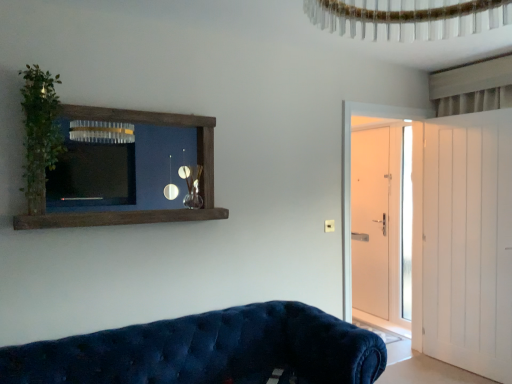
Question: Is green leafy plant at left surrounding white wooden door at right, placed as the second door when sorted from back to front?

Choices:
 (A) no
 (B) yes

Answer: (A)

Question: Is the position of green leafy plant at left more distant than that of white wooden door at right, the 2th door from the front?

Choices:
 (A) yes
 (B) no

Answer: (B)

Question: Is green leafy plant at left taller than white wooden door at right, the 2th door from the front?

Choices:
 (A) no
 (B) yes

Answer: (A)

Question: Are green leafy plant at left and white wooden door at right, the 2th door from the front, located far from each other?

Choices:
 (A) yes
 (B) no

Answer: (A)

Question: Is green leafy plant at left looking in the opposite direction of white wooden door at right, the 2th door from the front?

Choices:
 (A) yes
 (B) no

Answer: (B)

Question: From the image's perspective, is green leafy plant at left located beneath white wooden door at right, placed as the second door when sorted from back to front?

Choices:
 (A) yes
 (B) no

Answer: (B)

Question: Can you confirm if brown wooden shelf at upper left is shorter than white smooth door at right, the third door from the front?

Choices:
 (A) yes
 (B) no

Answer: (A)

Question: From a real-world perspective, is brown wooden shelf at upper left over white smooth door at right, the third door from the front?

Choices:
 (A) no
 (B) yes

Answer: (B)

Question: Can you confirm if brown wooden shelf at upper left is smaller than white smooth door at right, the 1th door from the back?

Choices:
 (A) no
 (B) yes

Answer: (A)

Question: Does brown wooden shelf at upper left turn towards white smooth door at right, the third door from the front?

Choices:
 (A) no
 (B) yes

Answer: (A)

Question: Is the surface of brown wooden shelf at upper left in direct contact with white smooth door at right, the 1th door from the back?

Choices:
 (A) yes
 (B) no

Answer: (B)

Question: From the image's perspective, is brown wooden shelf at upper left below white smooth door at right, the 1th door from the back?

Choices:
 (A) no
 (B) yes

Answer: (A)

Question: Would you say brown wooden shelf at upper left is a long distance from white wooden door at right, the 2th door from the front?

Choices:
 (A) no
 (B) yes

Answer: (B)